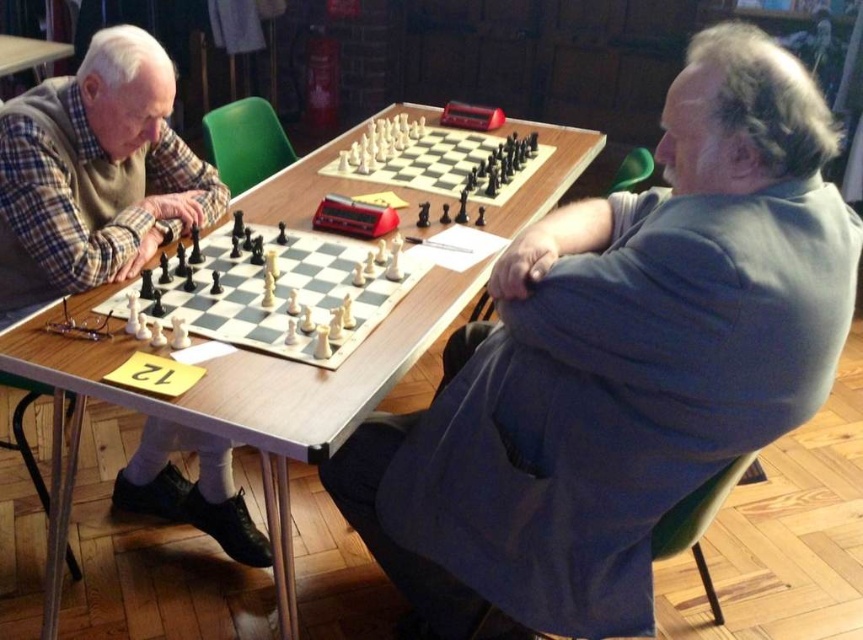
You are a chess player who just arrived at the table. You see the matte black chess set at left and the wooden chessboard at center. Which chess set is closer to you?

The matte black chess set at left is closer to you because it is positioned to the left of the wooden chessboard at center, which is further away.

You are a chess enthusiast observing the game. The matte black chess set at left and wooden chessboard at center are both on the table. Which object is thinner?

The matte black chess set at left is thinner than the wooden chessboard at center.